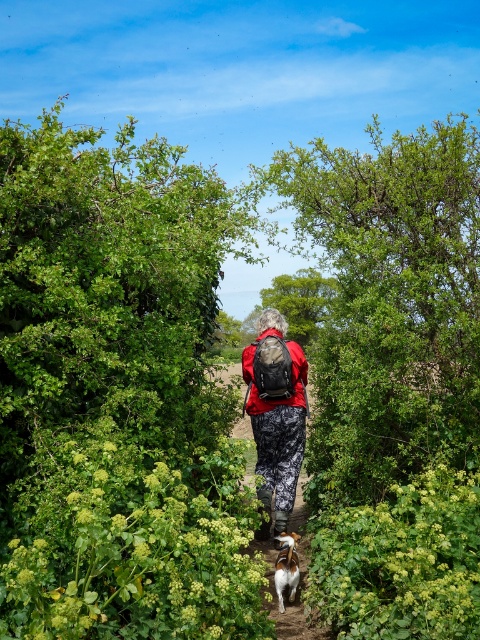
You are a photographer trying to capture a photo of the white fur dog at center without the matte black backpack at center blocking the view. Based on their sizes, can you position yourself so the dog is fully visible without the backpack overlapping?

The matte black backpack at center is much taller than the white fur dog at center. Therefore, positioning yourself lower to the ground might allow you to frame the shot so the dog is visible above the backpack, but the backpack could still partially block the view depending on their exact positions along the path.

You are a hiker who wants to take a photo of the white fur dog at center and the matte black backpack at center. Which object should you adjust your camera focus on first if you want to capture both in the same frame?

The matte black backpack at center is to the left of white fur dog at center, so you should focus on the white fur dog at center first as it is closer to the camera.